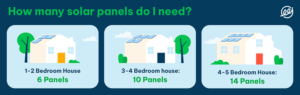
The width and height of the screenshot is (300, 95). I want to click on windows, so click(x=51, y=50), click(x=69, y=51), click(x=150, y=51), click(x=169, y=50), click(x=224, y=50), click(x=236, y=50), click(x=259, y=43).